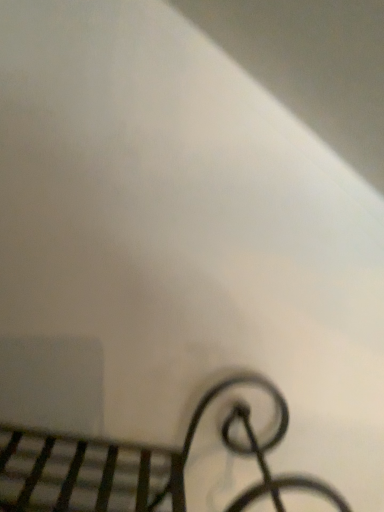
Find the location of a particular element. The image size is (384, 512). black metal bench at lower left is located at coordinates (133, 466).

This screenshot has width=384, height=512. What do you see at coordinates (133, 466) in the screenshot?
I see `black metal bench at lower left` at bounding box center [133, 466].

At what (x,y) coordinates should I click in order to perform the action: click on black metal bench at lower left. Please return your answer as a coordinate pair (x, y). The image size is (384, 512). Looking at the image, I should click on (133, 466).